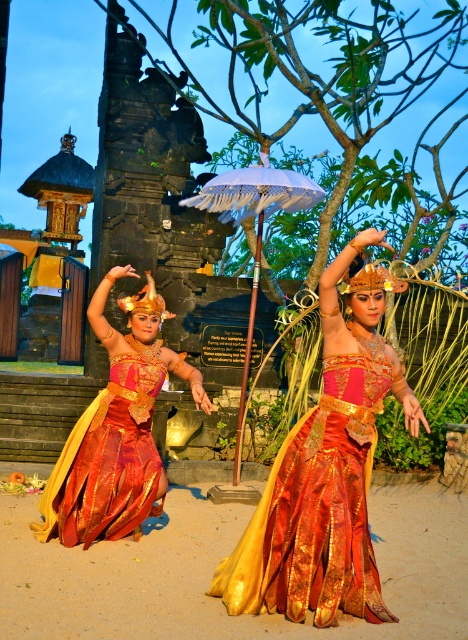
Question: Which object is farther from the camera taking this photo?

Choices:
 (A) white fringed umbrella at center
 (B) shiny gold dress at center
 (C) shiny silk skirt at center

Answer: (A)

Question: Which point appears closest to the camera in this image?

Choices:
 (A) (241, 589)
 (B) (109, 276)
 (C) (270, 352)

Answer: (A)

Question: Among these points, which one is nearest to the camera?

Choices:
 (A) (241, 218)
 (B) (82, 506)

Answer: (B)

Question: Is shiny gold dress at center smaller than white fringed umbrella at center?

Choices:
 (A) yes
 (B) no

Answer: (A)

Question: Is shiny gold dress at center below white fringed umbrella at center?

Choices:
 (A) no
 (B) yes

Answer: (B)

Question: Is shiny gold dress at center positioned behind white fringed umbrella at center?

Choices:
 (A) no
 (B) yes

Answer: (A)